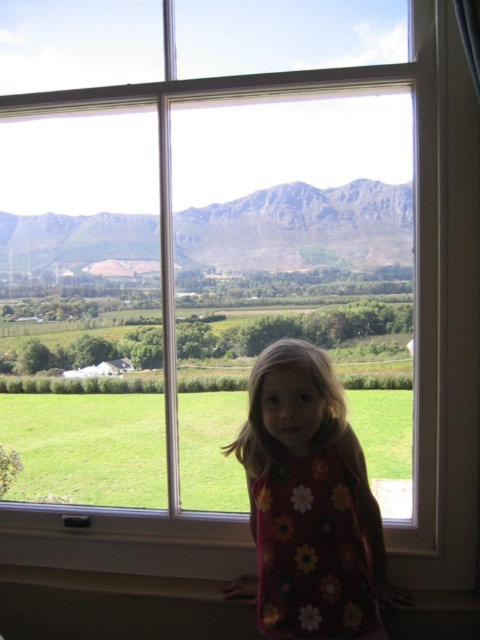
You are a fashion designer observing the image. You need to determine which object at the center is smaller between the floral fabric dress at center and the rocky gray mountain at center. Which one is it?

The floral fabric dress at center is smaller than the rocky gray mountain at center.

You are a photographer planning to take a portrait of the young girl wearing the floral fabric dress at center while incorporating the view of the rocky gray mountain at center through the window. Based on their sizes in the image, which object should appear larger in your photo?

The floral fabric dress at center is taller than the rocky gray mountain at center, so the dress should appear larger in the photo.